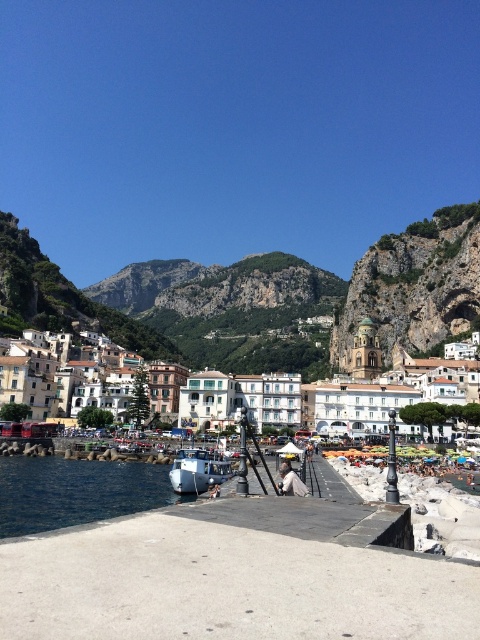
You are standing on the walkway leading to the town and want to take a photo of the white stucco buildings at center. According to the coordinates provided, where should you position yourself to capture them in the frame?

The white stucco buildings at center are located at coordinates point (304, 403), so positioning yourself at that coordinate will ensure they are centered in your photo.

Based on the photo, you are standing on the walkway and want to compare the height of the deep blue water at lower left and the white matte boat at center. Which one is taller?

The deep blue water at lower left is not as tall as the white matte boat at center, so the white matte boat at center is taller.